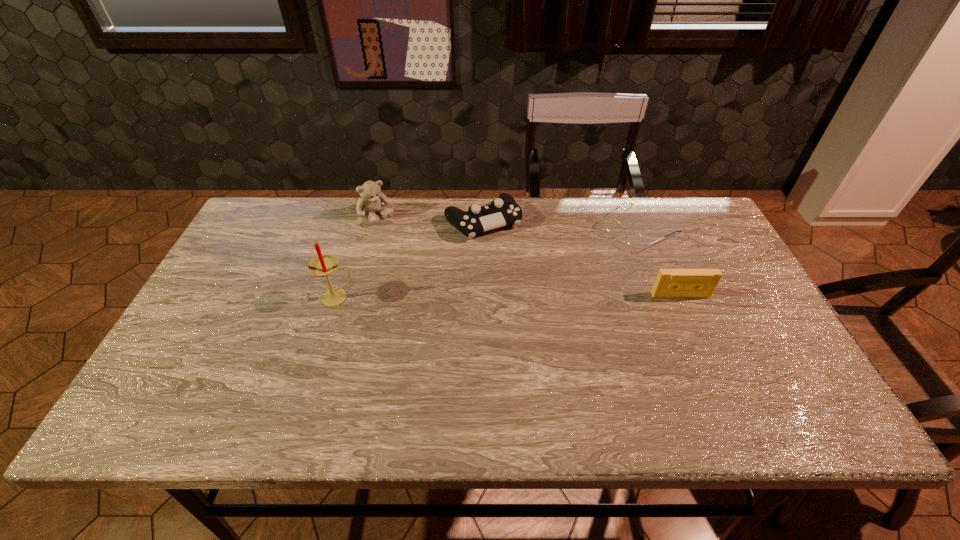
Identify the location of free space on the desktop that is between the tallest object and the videotape and is positioned through the lenses of the spectacles. Image resolution: width=960 pixels, height=540 pixels. (533, 296).

This screenshot has height=540, width=960. Find the location of `vacant spot on the desktop that is between the tallest object and the videotape and is positioned on the surface of the third object from right to left`. vacant spot on the desktop that is between the tallest object and the videotape and is positioned on the surface of the third object from right to left is located at coordinates (536, 296).

You are a GUI agent. You are given a task and a screenshot of the screen. Output one action in this format:
    pyautogui.click(x=<x>, y=<y>)
    Task: Click on the vacant space on the desktop that is between the candle and the videotape and is positioned on the face of the fourth shortest object
    
    Given the screenshot: What is the action you would take?
    pyautogui.click(x=458, y=297)